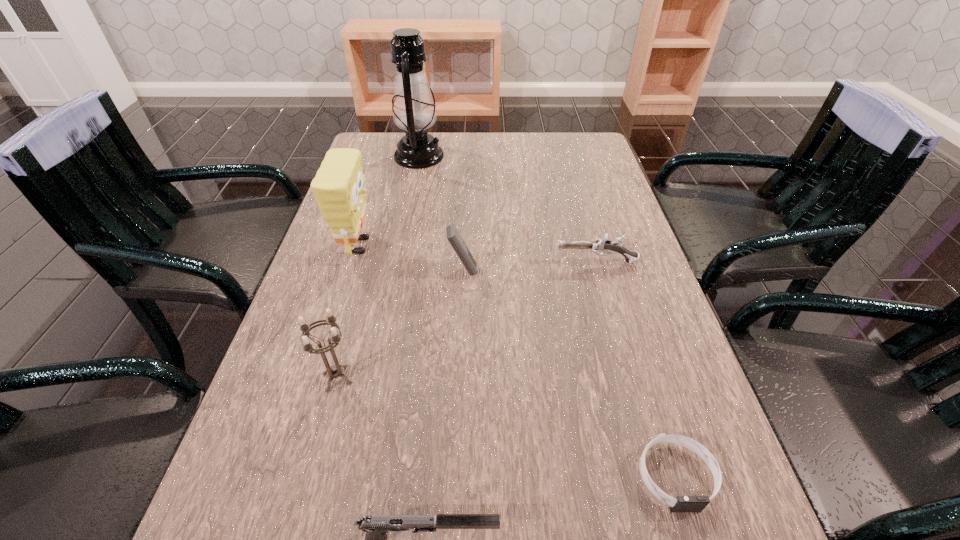
Find the location of a particular element. This screenshot has height=540, width=960. free space between the farthest object and the fifth farthest object is located at coordinates (378, 267).

Find the location of `vacant space that's between the second tallest object and the shortest object`. vacant space that's between the second tallest object and the shortest object is located at coordinates (517, 361).

Where is `free area in between the farther gun and the fifth shortest object`? The height and width of the screenshot is (540, 960). free area in between the farther gun and the fifth shortest object is located at coordinates (467, 320).

Locate an element on the screen. This screenshot has width=960, height=540. the fourth closest object to the tallest object is located at coordinates (334, 371).

Identify the location of object that ranks as the sixth closest to the sixth shortest object. (682, 503).

Image resolution: width=960 pixels, height=540 pixels. In order to click on free space that satisfies the following two spatial constraints: 1. on the face of the sponge; 2. on the back side of the third tallest object in this screenshot , I will do `click(319, 378)`.